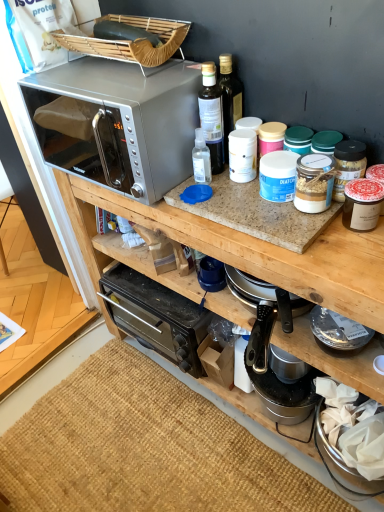
Question: In terms of height, does burlap mat at lower center look taller or shorter compared to metallic silver coffee maker at center, which is the 2th appliance from front to back?

Choices:
 (A) short
 (B) tall

Answer: (A)

Question: Looking at the image, does burlap mat at lower center seem bigger or smaller compared to metallic silver coffee maker at center, which is the first appliance in back-to-front order?

Choices:
 (A) big
 (B) small

Answer: (B)

Question: Which object is positioned farthest from the burlap mat at lower center?

Choices:
 (A) matte glass jar at right, which is the first appliance from top to bottom
 (B) translucent plastic spray bottle at upper center, the 1th bottle from the left
 (C) translucent glass bottle at upper center, marked as the second bottle in a left-to-right arrangement
 (D) satin silver microwave at upper left
 (E) silver metallic microwave at upper left

Answer: (C)

Question: Which is farther from the matte glass jar at right, the first appliance positioned from the front?

Choices:
 (A) metallic silver coffee maker at center, which is the first appliance from bottom to top
 (B) translucent glass bottle at upper center, marked as the second bottle in a left-to-right arrangement
 (C) satin silver microwave at upper left
 (D) burlap mat at lower center
 (E) silver metallic microwave at upper left

Answer: (D)